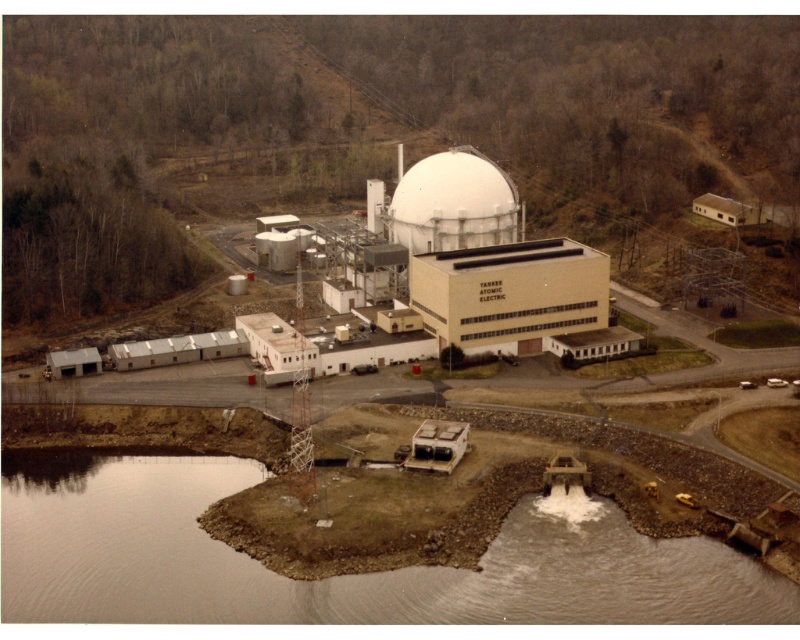
Can you confirm if smooth concrete dam at lower center is positioned below white matte building at center?

Correct, smooth concrete dam at lower center is located below white matte building at center.

Does point (244, 477) lie behind point (496, 314)?

No, (244, 477) is closer to viewer.

Find the location of a particular element. This screenshot has height=640, width=800. smooth concrete dam at lower center is located at coordinates (341, 576).

Is white matte building at center to the right of white matte dome at center from the viewer's perspective?

Incorrect, white matte building at center is not on the right side of white matte dome at center.

Is the position of white matte building at center more distant than that of white matte dome at center?

That is False.

Where is `white matte building at center`? This screenshot has width=800, height=640. white matte building at center is located at coordinates (468, 276).

Is smooth concrete dam at lower center in front of white matte dome at center?

Yes, it is in front of white matte dome at center.

Is point (16, 518) farther from camera compared to point (458, 154)?

No, it is not.

You are a GUI agent. You are given a task and a screenshot of the screen. Output one action in this format:
    pyautogui.click(x=<x>, y=<y>)
    Task: Click on the smooth concrete dam at lower center
    The height and width of the screenshot is (640, 800).
    Given the screenshot: What is the action you would take?
    pyautogui.click(x=341, y=576)